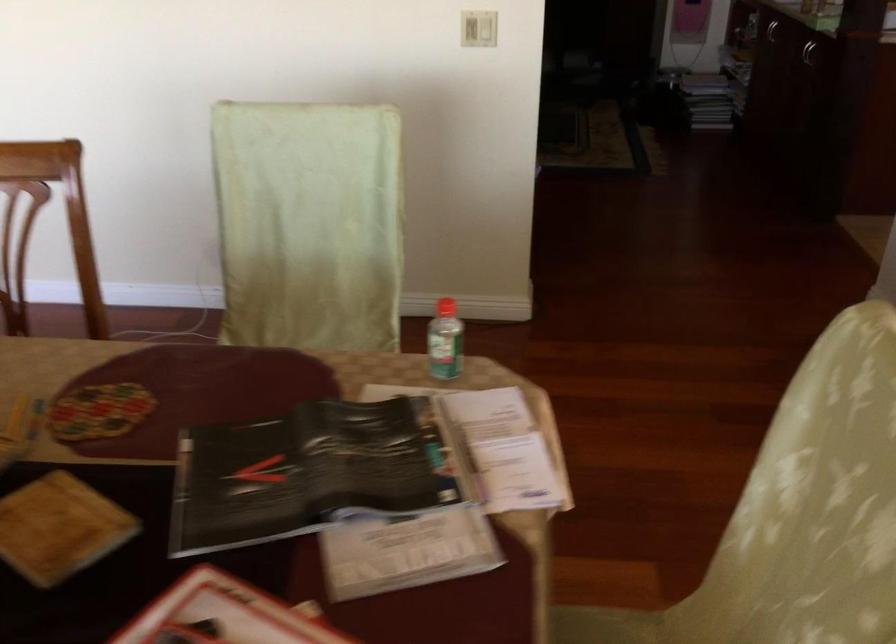
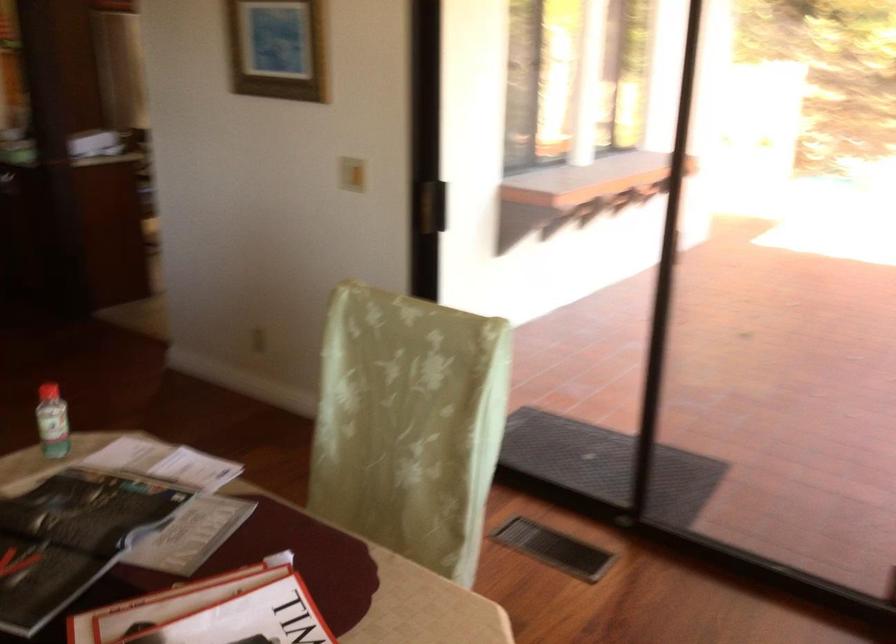
Question: The camera is either moving clockwise (left) or counter-clockwise (right) around the object. The first image is from the beginning of the video and the second image is from the end. Is the camera moving left or right when shooting the video?

Choices:
 (A) Left
 (B) Right

Answer: (A)